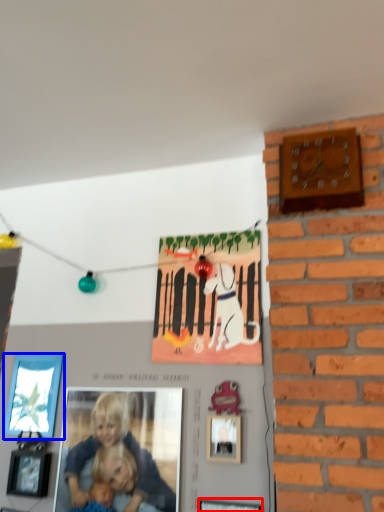
Question: Which of the following is the closest to the observer, picture frame (highlighted by a red box) or picture frame (highlighted by a blue box)?

Choices:
 (A) picture frame
 (B) picture frame

Answer: (A)